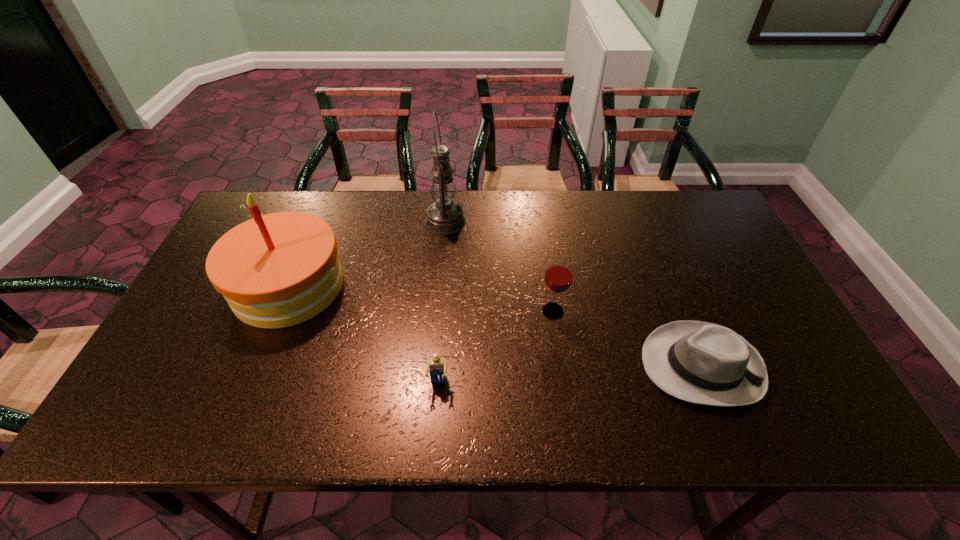
What are the coordinates of `free spot that satisfies the following two spatial constraints: 1. on the front side of the oil lamp; 2. on the left side of the fourth object from left to right` in the screenshot? It's located at pyautogui.click(x=438, y=311).